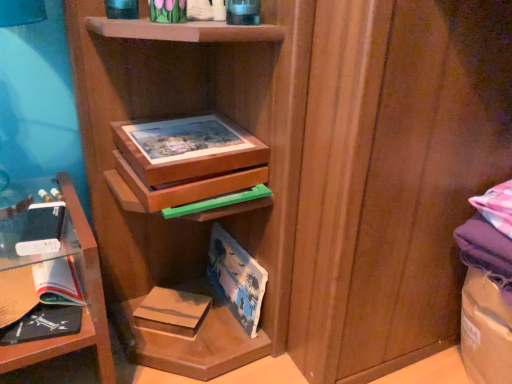
In order to click on black matte book at lower left in this screenshot , I will do `click(42, 324)`.

What is the approximate height of wooden puzzle box at center?

wooden puzzle box at center is 4.74 inches tall.

The image size is (512, 384). I want to click on brown cardboard book at lower center, the second paperback book from the left, so click(x=172, y=311).

Is the position of brown cardboard book at lower center, the 2th paperback book when ordered from right to left, less distant than that of matte paper paperback book at center, the first paperback book in the right-to-left sequence?

No, it is not.

Based on their sizes in the image, would you say brown cardboard book at lower center, the second paperback book from the left, is bigger or smaller than matte paper paperback book at center, arranged as the third paperback book when viewed from the left?

In the image, brown cardboard book at lower center, the second paperback book from the left, appears to be smaller than matte paper paperback book at center, arranged as the third paperback book when viewed from the left.

Is brown cardboard book at lower center, the second paperback book from the left, surrounding matte paper paperback book at center, arranged as the third paperback book when viewed from the left?

No, matte paper paperback book at center, arranged as the third paperback book when viewed from the left, is not surrounded by brown cardboard book at lower center, the second paperback book from the left.

From a real-world perspective, is brown cardboard book at lower center, the 2th paperback book when ordered from right to left, beneath matte paper paperback book at center, the first paperback book in the right-to-left sequence?

Yes.

In the scene shown: Which is correct: white glossy paperback book at lower left, which is counted as the 3th paperback book, starting from the right, is inside brown cardboard book at lower center, the second paperback book from the left, or outside of it?

white glossy paperback book at lower left, which is counted as the 3th paperback book, starting from the right, cannot be found inside brown cardboard book at lower center, the second paperback book from the left.

What's the angular difference between white glossy paperback book at lower left, which is counted as the 3th paperback book, starting from the right, and brown cardboard book at lower center, the 2th paperback book when ordered from right to left,'s facing directions?

45.7 degrees.

Which is closer, (57, 301) or (191, 296)?

The point (57, 301) is closer.

From the picture: Is matte paper paperback book at center, the first paperback book in the right-to-left sequence, smaller than clear glass shelf at left?

Yes.

Are matte paper paperback book at center, the first paperback book in the right-to-left sequence, and clear glass shelf at left far apart?

No, matte paper paperback book at center, the first paperback book in the right-to-left sequence, is not far away from clear glass shelf at left.

Could you measure the distance between matte paper paperback book at center, the first paperback book in the right-to-left sequence, and clear glass shelf at left?

matte paper paperback book at center, the first paperback book in the right-to-left sequence, is 14.94 inches from clear glass shelf at left.

Considering the positions of objects wooden puzzle box at center and clear glass shelf at left in the image provided, who is in front, wooden puzzle box at center or clear glass shelf at left?

clear glass shelf at left.

Between wooden puzzle box at center and clear glass shelf at left, which one has less height?

wooden puzzle box at center is shorter.

From a real-world perspective, is wooden puzzle box at center on clear glass shelf at left?

Yes.

From the image's perspective, is matte paper paperback book at center, arranged as the third paperback book when viewed from the left, above black matte book at lower left?

Yes, from the image's perspective, matte paper paperback book at center, arranged as the third paperback book when viewed from the left, is over black matte book at lower left.

Considering the positions of objects matte paper paperback book at center, the first paperback book in the right-to-left sequence, and black matte book at lower left in the image provided, who is more to the right, matte paper paperback book at center, the first paperback book in the right-to-left sequence, or black matte book at lower left?

Positioned to the right is matte paper paperback book at center, the first paperback book in the right-to-left sequence.

Considering the relative sizes of matte paper paperback book at center, arranged as the third paperback book when viewed from the left, and black matte book at lower left in the image provided, is matte paper paperback book at center, arranged as the third paperback book when viewed from the left, wider than black matte book at lower left?

Incorrect, the width of matte paper paperback book at center, arranged as the third paperback book when viewed from the left, does not surpass that of black matte book at lower left.

How different are the orientations of matte paper paperback book at center, the first paperback book in the right-to-left sequence, and black matte book at lower left in degrees?

The facing directions of matte paper paperback book at center, the first paperback book in the right-to-left sequence, and black matte book at lower left are 79.7 degrees apart.

Looking at the image, does brown cardboard book at lower center, the second paperback book from the left, seem bigger or smaller compared to clear glass shelf at left?

Clearly, brown cardboard book at lower center, the second paperback book from the left, is smaller in size than clear glass shelf at left.

Between brown cardboard book at lower center, the 2th paperback book when ordered from right to left, and clear glass shelf at left, which one has smaller width?

brown cardboard book at lower center, the 2th paperback book when ordered from right to left.

Does brown cardboard book at lower center, the second paperback book from the left, appear on the left side of clear glass shelf at left?

No, brown cardboard book at lower center, the second paperback book from the left, is not to the left of clear glass shelf at left.

Considering their positions, is black matte book at lower left located in front of or behind clear glass shelf at left?

black matte book at lower left is behind clear glass shelf at left.

Consider the image. Considering the sizes of black matte book at lower left and clear glass shelf at left in the image, is black matte book at lower left taller or shorter than clear glass shelf at left?

Considering their sizes, black matte book at lower left has less height than clear glass shelf at left.

Find the location of a particular element. This screenshot has height=384, width=512. shelf on the left of black matte book at lower left is located at coordinates (82, 308).

Looking at the image, does black matte book at lower left seem bigger or smaller compared to clear glass shelf at left?

black matte book at lower left is smaller than clear glass shelf at left.

From a real-world perspective, count 1st paperback books upward from the brown cardboard book at lower center, the second paperback book from the left, and point to it. Please provide its 2D coordinates.

[(237, 278)]

Find the location of `paperback book on the left of brown cardboard book at lower center, the second paperback book from the left`. paperback book on the left of brown cardboard book at lower center, the second paperback book from the left is located at coordinates (57, 282).

Estimate the real-world distances between objects in this image. Which object is closer to matte paper paperback book at center, the first paperback book in the right-to-left sequence, white glossy paperback book at lower left, the 1th paperback book in the left-to-right sequence, or brown cardboard book at lower center, the 2th paperback book when ordered from right to left?

Based on the image, brown cardboard book at lower center, the 2th paperback book when ordered from right to left, appears to be nearer to matte paper paperback book at center, the first paperback book in the right-to-left sequence.

Which object lies further to the anchor point matte paper paperback book at center, arranged as the third paperback book when viewed from the left, clear glass shelf at left or black matte book at lower left?

black matte book at lower left is positioned further to the anchor matte paper paperback book at center, arranged as the third paperback book when viewed from the left.

Looking at the image, which one is located closer to matte paper paperback book at center, arranged as the third paperback book when viewed from the left, clear glass shelf at left or brown cardboard book at lower center, the second paperback book from the left?

brown cardboard book at lower center, the second paperback book from the left, is positioned closer to the anchor matte paper paperback book at center, arranged as the third paperback book when viewed from the left.

When comparing their distances from white glossy paperback book at lower left, the 1th paperback book in the left-to-right sequence, does brown cardboard book at lower center, the second paperback book from the left, or clear glass shelf at left seem further?

brown cardboard book at lower center, the second paperback book from the left, is positioned further to the anchor white glossy paperback book at lower left, the 1th paperback book in the left-to-right sequence.

When comparing their distances from black matte book at lower left, does wooden puzzle box at center or brown cardboard book at lower center, the 2th paperback book when ordered from right to left, seem closer?

Based on the image, brown cardboard book at lower center, the 2th paperback book when ordered from right to left, appears to be nearer to black matte book at lower left.

Based on their spatial positions, is wooden puzzle box at center or clear glass shelf at left further from white glossy paperback book at lower left, which is counted as the 3th paperback book, starting from the right?

wooden puzzle box at center is further to white glossy paperback book at lower left, which is counted as the 3th paperback book, starting from the right.

Looking at the image, which one is located further to brown cardboard book at lower center, the second paperback book from the left, clear glass shelf at left or matte paper paperback book at center, arranged as the third paperback book when viewed from the left?

The object further to brown cardboard book at lower center, the second paperback book from the left, is clear glass shelf at left.

From the image, which object appears to be nearer to black matte book at lower left, brown cardboard book at lower center, the second paperback book from the left, or wooden puzzle box at center?

brown cardboard book at lower center, the second paperback book from the left, is positioned closer to the anchor black matte book at lower left.

The image size is (512, 384). Identify the location of book positioned between clear glass shelf at left and white glossy paperback book at lower left, which is counted as the 3th paperback book, starting from the right, from near to far. (42, 324).

In order to click on book that lies between wooden puzzle box at center and brown cardboard book at lower center, the 2th paperback book when ordered from right to left, from top to bottom in this screenshot , I will do `click(42, 324)`.

Identify the location of book located between white glossy paperback book at lower left, the 1th paperback book in the left-to-right sequence, and matte paper paperback book at center, the first paperback book in the right-to-left sequence, in the left-right direction. (42, 324).

Image resolution: width=512 pixels, height=384 pixels. What are the coordinates of `paperback book between white glossy paperback book at lower left, the 1th paperback book in the left-to-right sequence, and matte paper paperback book at center, arranged as the third paperback book when viewed from the left, from left to right` in the screenshot? It's located at (172, 311).